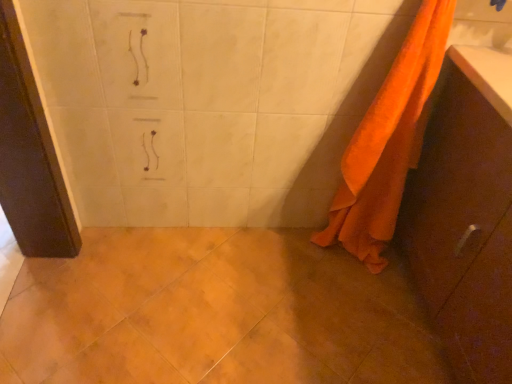
Question: Considering the relative sizes of orange fabric cabinet at right and orange fabric towel at right in the image provided, is orange fabric cabinet at right thinner than orange fabric towel at right?

Choices:
 (A) yes
 (B) no

Answer: (B)

Question: Is orange fabric cabinet at right facing away from orange fabric towel at right?

Choices:
 (A) yes
 (B) no

Answer: (B)

Question: Is orange fabric cabinet at right surrounding orange fabric towel at right?

Choices:
 (A) no
 (B) yes

Answer: (A)

Question: Is orange fabric cabinet at right at the left side of orange fabric towel at right?

Choices:
 (A) yes
 (B) no

Answer: (B)

Question: Is orange fabric cabinet at right oriented towards orange fabric towel at right?

Choices:
 (A) yes
 (B) no

Answer: (A)

Question: Is orange fabric cabinet at right to the right of orange fabric towel at right from the viewer's perspective?

Choices:
 (A) no
 (B) yes

Answer: (B)

Question: From a real-world perspective, does orange fabric towel at right stand above orange fabric cabinet at right?

Choices:
 (A) yes
 (B) no

Answer: (A)

Question: Considering the relative sizes of orange fabric towel at right and orange fabric cabinet at right in the image provided, is orange fabric towel at right bigger than orange fabric cabinet at right?

Choices:
 (A) yes
 (B) no

Answer: (B)

Question: Does orange fabric towel at right have a lesser height compared to orange fabric cabinet at right?

Choices:
 (A) no
 (B) yes

Answer: (A)

Question: Is orange fabric towel at right not near orange fabric cabinet at right?

Choices:
 (A) no
 (B) yes

Answer: (A)

Question: From the image's perspective, would you say orange fabric towel at right is positioned over orange fabric cabinet at right?

Choices:
 (A) yes
 (B) no

Answer: (A)

Question: Considering the relative sizes of orange fabric towel at right and orange fabric cabinet at right in the image provided, is orange fabric towel at right smaller than orange fabric cabinet at right?

Choices:
 (A) no
 (B) yes

Answer: (B)

Question: Considering the positions of point (462, 97) and point (349, 172), is point (462, 97) closer or farther from the camera than point (349, 172)?

Choices:
 (A) closer
 (B) farther

Answer: (A)